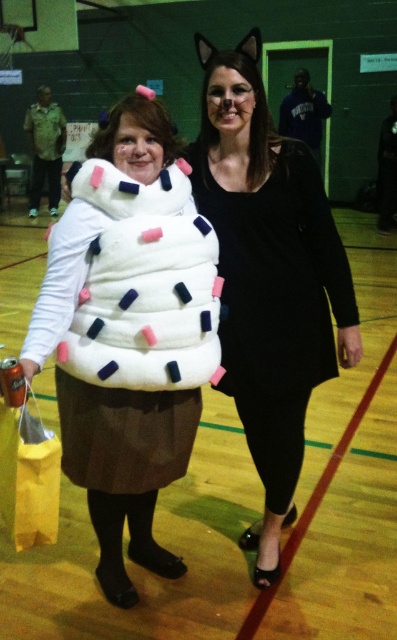
You are standing in the gymnasium and see two points marked in the scene. One is at point [136,168] and the other is at point [277,202]. Which point is closer to you?

Point [136,168] is closer to the viewer than point [277,202].

You are at a costume party and need to find the fuzzy white cupcake at center. Which direction should you look relative to the black matte dress at center?

The fuzzy white cupcake at center is positioned on the left side of the black matte dress at center, so you should look to the left of the black matte dress at center to find it.

You are at the center of the gymnasium and see a fuzzy white cupcake at center. Where is the fuzzy white cupcake located in relation to the gymnasium? Please provide coordinates in the format of a point with two decimal places.

The fuzzy white cupcake at center is located at coordinates point (129, 330) in the gymnasium.